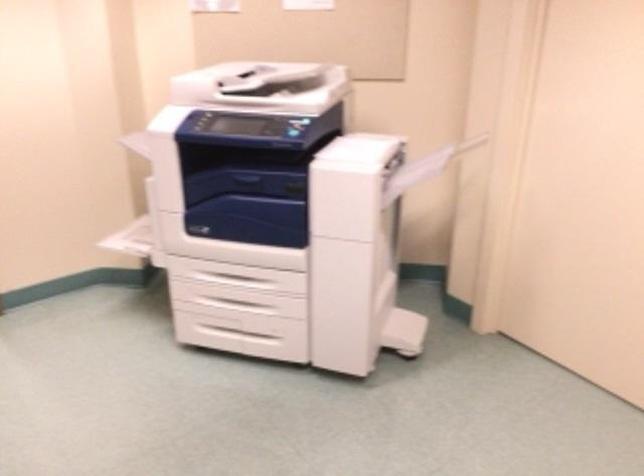
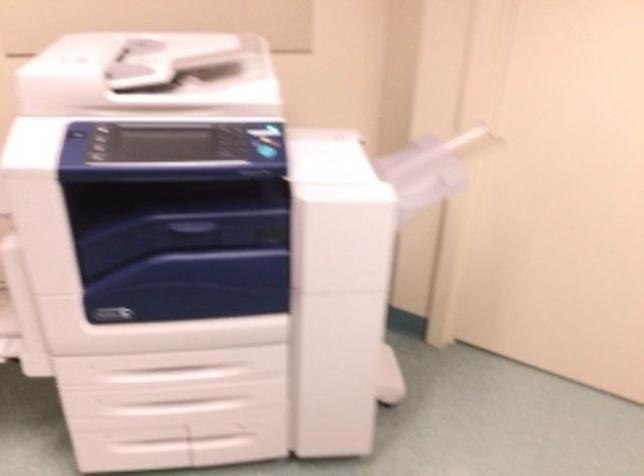
In a continuous first-person perspective shot, in which direction is the camera moving?

The movement direction of the cameraman is left, forward.